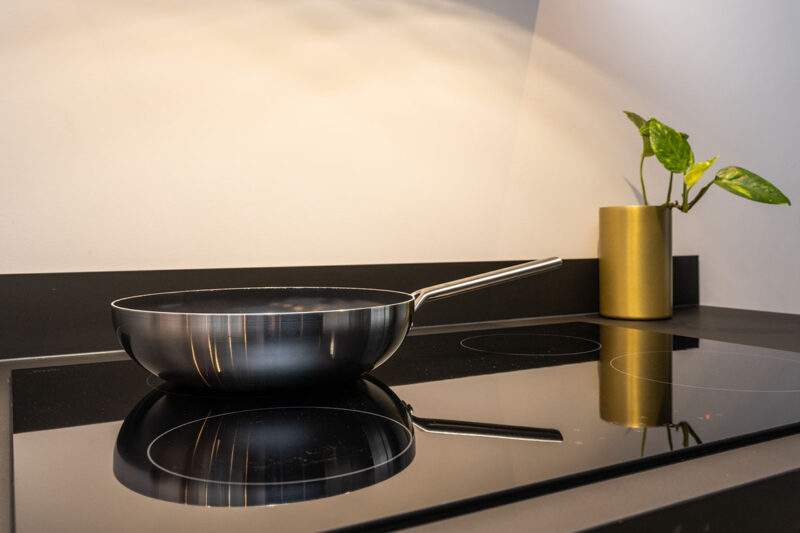
You are a GUI agent. You are given a task and a screenshot of the screen. Output one action in this format:
    pyautogui.click(x=<x>, y=<y>)
    Task: Click on the back left burner
    
    Given the screenshot: What is the action you would take?
    pyautogui.click(x=170, y=386)